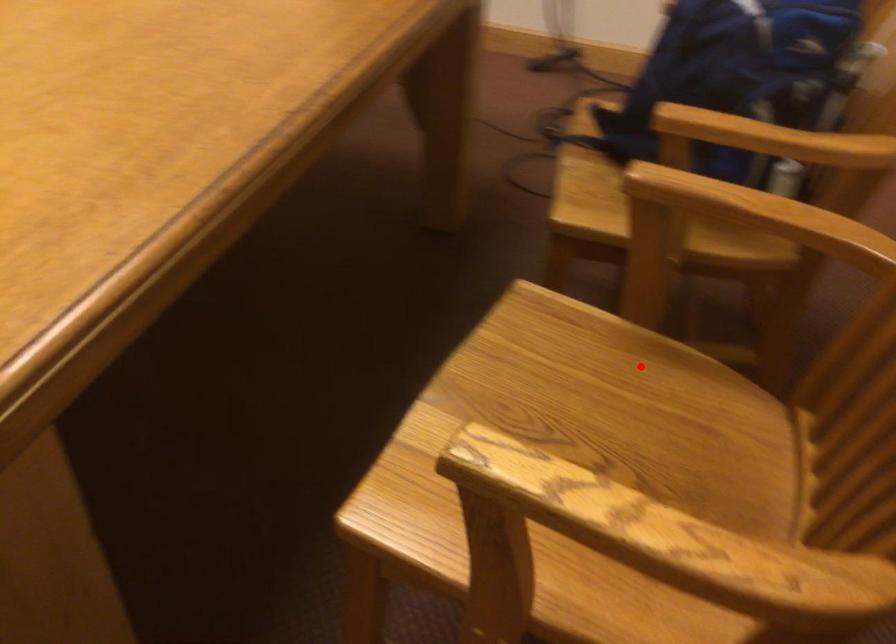
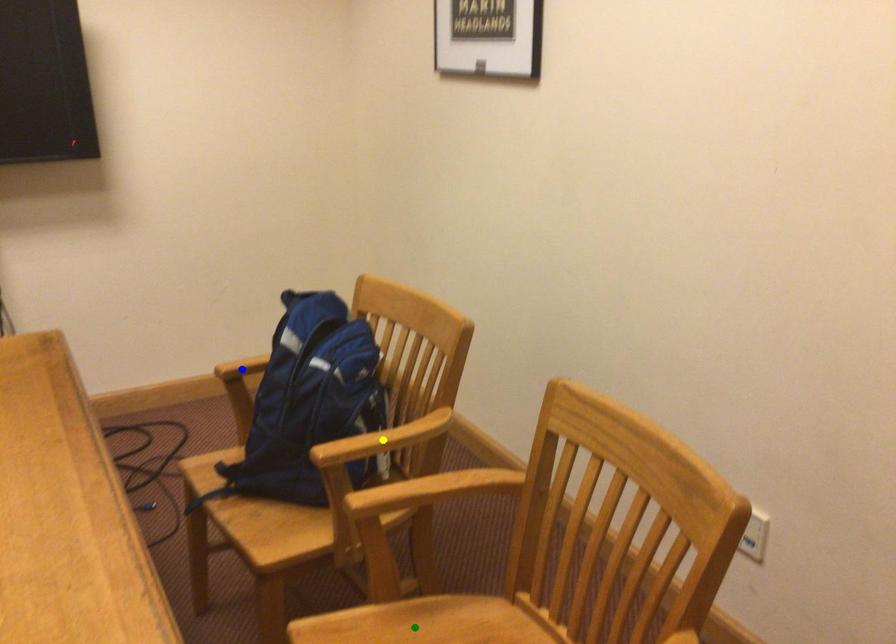
Question: I am providing you with two images of the same scene from different viewpoints. A red point is marked on the first image. You are given multiple points on the second image. Can you choose the point in image 2 that corresponds to the point in image 1?

Choices:
 (A) green point
 (B) yellow point
 (C) blue point

Answer: (A)